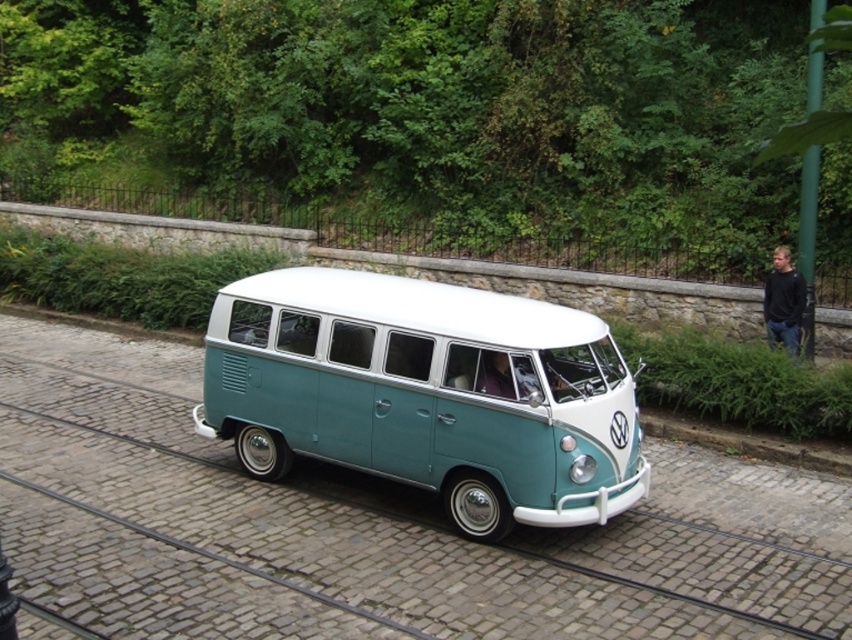
Question: Which object appears closest to the camera in this image?

Choices:
 (A) teal matte van at center
 (B) black cotton shirt at right

Answer: (A)

Question: Observing the image, what is the correct spatial positioning of metal train track at center in reference to teal matte van at center?

Choices:
 (A) left
 (B) right

Answer: (A)

Question: Estimate the real-world distances between objects in this image. Which object is closer to the metal train track at center?

Choices:
 (A) black cotton shirt at right
 (B) teal matte van at center

Answer: (B)

Question: Which point is closer to the camera taking this photo?

Choices:
 (A) (611, 612)
 (B) (786, 289)
 (C) (278, 397)

Answer: (A)

Question: Does metal train track at center have a smaller size compared to teal matte van at center?

Choices:
 (A) yes
 (B) no

Answer: (B)

Question: Is metal train track at center smaller than black cotton shirt at right?

Choices:
 (A) no
 (B) yes

Answer: (A)